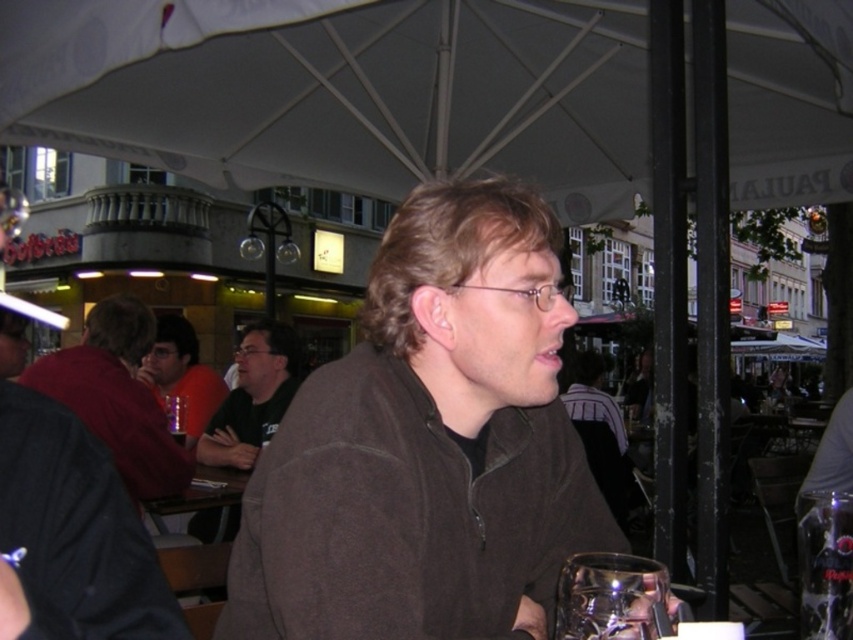
Does transparent glass at lower right appear over matte black shirt at center?

No.

Which is behind, point (653, 563) or point (209, 408)?

Positioned behind is point (209, 408).

Between point (656, 582) and point (196, 419), which one is positioned behind?

Positioned behind is point (196, 419).

Find the location of a particular element. The image size is (853, 640). transparent glass at lower right is located at coordinates (611, 596).

Locate an element on the screen. dark red shirt at left is located at coordinates (117, 396).

Who is higher up, dark red shirt at left or transparent glass at lower right?

Positioned higher is dark red shirt at left.

What are the coordinates of `dark red shirt at left` in the screenshot? It's located at (117, 396).

How far apart are dark red shirt at left and clear plastic glass at lower right?

dark red shirt at left and clear plastic glass at lower right are 7.64 feet apart from each other.

You are a GUI agent. You are given a task and a screenshot of the screen. Output one action in this format:
    pyautogui.click(x=<x>, y=<y>)
    Task: Click on the dark red shirt at left
    Image resolution: width=853 pixels, height=640 pixels.
    Given the screenshot: What is the action you would take?
    pyautogui.click(x=117, y=396)

What are the coordinates of `dark red shirt at left` in the screenshot? It's located at (117, 396).